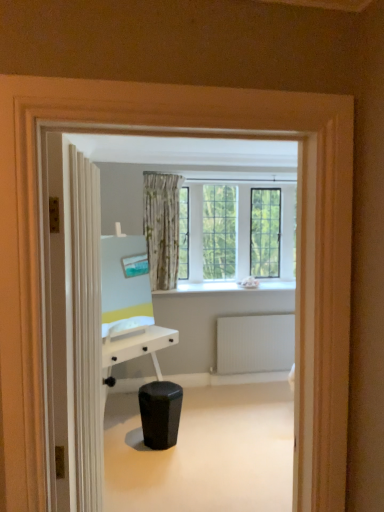
Question: Considering the positions of white matte radiator at lower right and white smooth window sill at center in the image, is white matte radiator at lower right wider or thinner than white smooth window sill at center?

Choices:
 (A) wide
 (B) thin

Answer: (B)

Question: From the image's perspective, is white matte radiator at lower right positioned above or below white smooth window sill at center?

Choices:
 (A) above
 (B) below

Answer: (B)

Question: Which object is positioned closest to the white matte radiator at lower right?

Choices:
 (A) white textured door at left
 (B) black matte music stool at center
 (C) white smooth window sill at center

Answer: (C)

Question: Estimate the real-world distances between objects in this image. Which object is closer to the white smooth window sill at center?

Choices:
 (A) black matte music stool at center
 (B) white textured door at left
 (C) white matte radiator at lower right

Answer: (C)